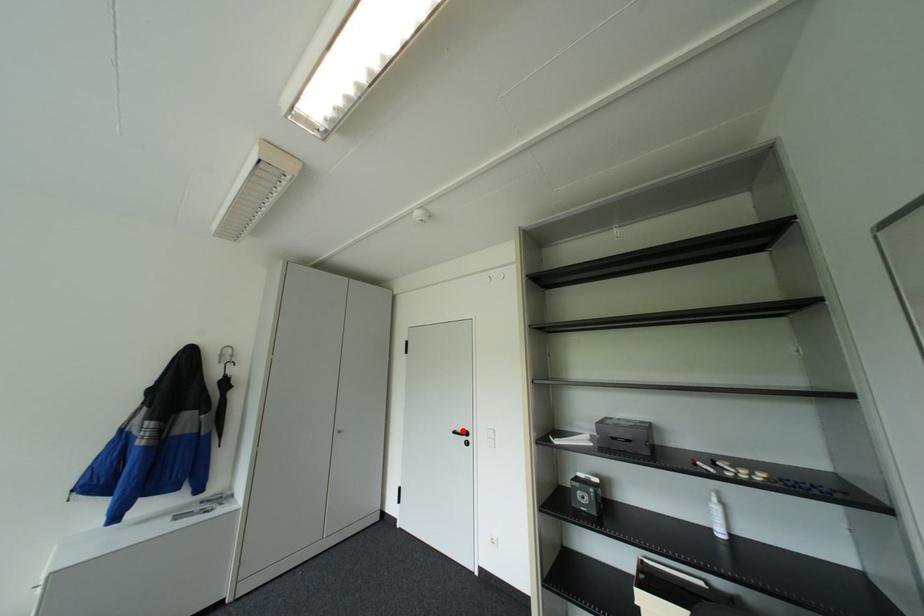
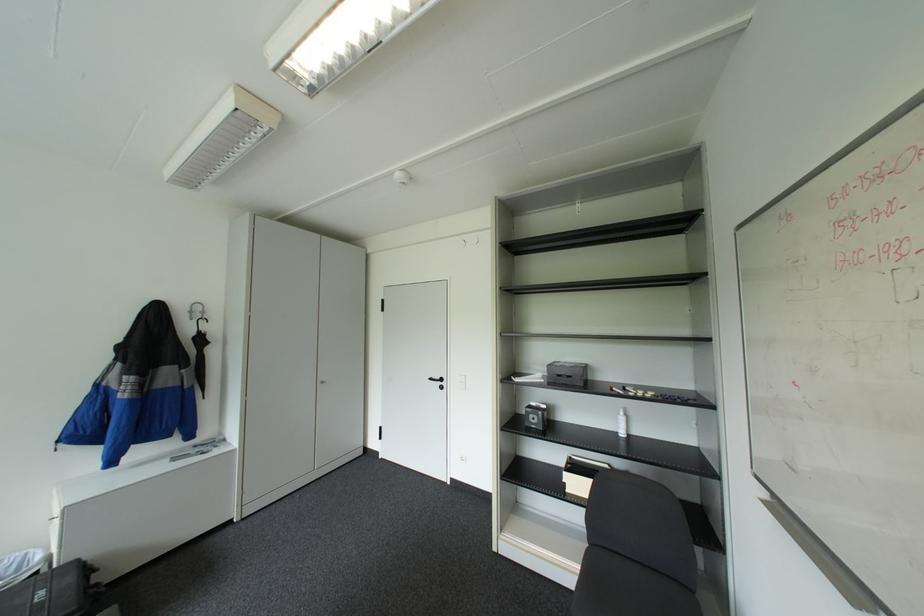
Find the pixel in the second image that matches the highlighted location in the first image.

(439, 378)